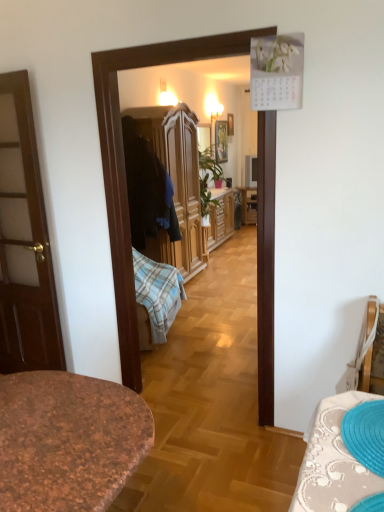
Question: From the image's perspective, is wooden picture frame at upper center, which ranks as the first picture frame in right-to-left order, positioned above or below wooden wardrobe at center?

Choices:
 (A) below
 (B) above

Answer: (B)

Question: In terms of height, does wooden picture frame at upper center, which ranks as the second picture frame in left-to-right order, look taller or shorter compared to wooden wardrobe at center?

Choices:
 (A) short
 (B) tall

Answer: (A)

Question: Which is farther from the wooden picture frame at center, which appears as the 2th picture frame when viewed from the right?

Choices:
 (A) wooden wardrobe at center
 (B) matte black television at center
 (C) wooden picture frame at upper center, which ranks as the first picture frame in right-to-left order

Answer: (A)

Question: Estimate the real-world distances between objects in this image. Which object is farther from the wooden picture frame at upper center, which ranks as the first picture frame in right-to-left order?

Choices:
 (A) wooden picture frame at center, marked as the 1th picture frame in a left-to-right arrangement
 (B) matte black television at center
 (C) wooden wardrobe at center

Answer: (C)